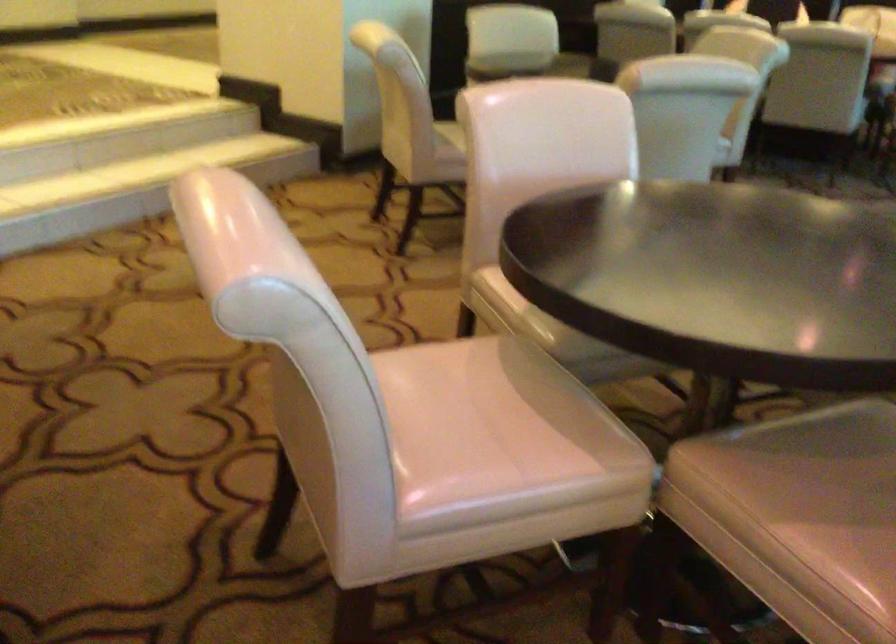
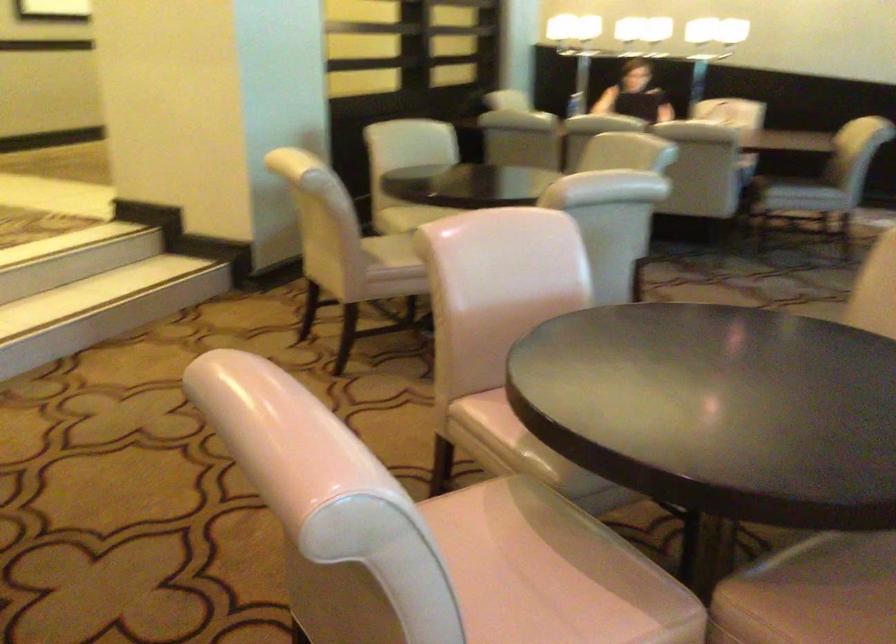
The point at (x=475, y=427) is marked in the first image. Where is the corresponding point in the second image?

(520, 587)